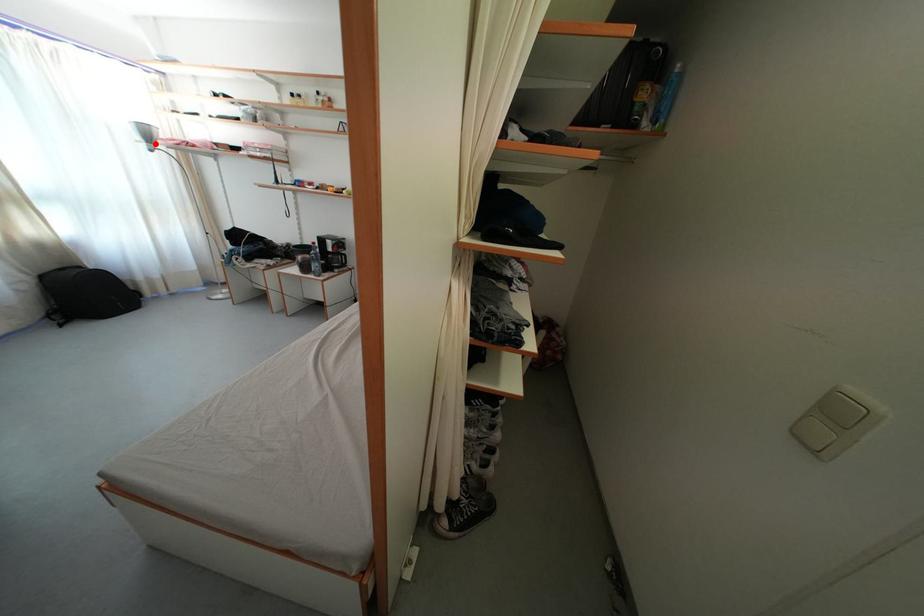
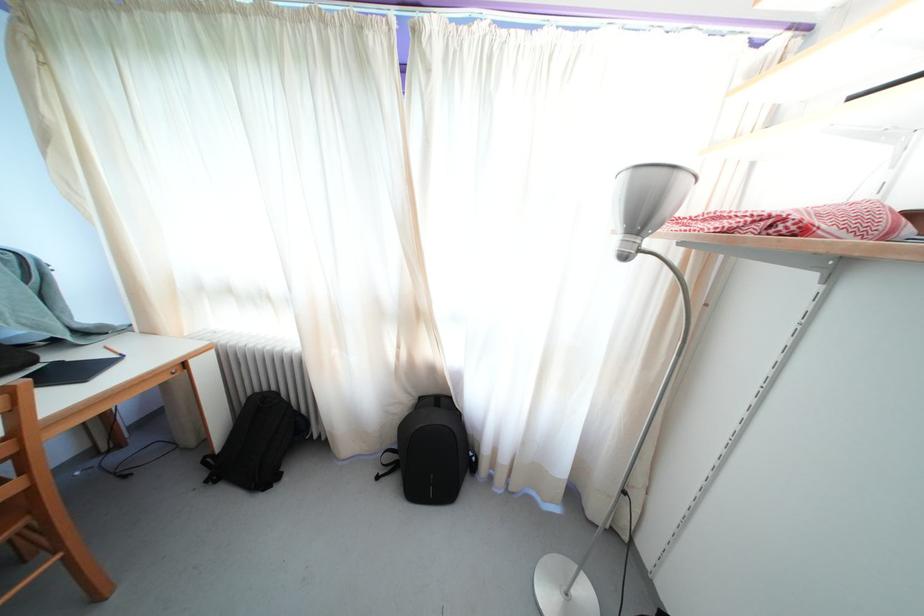
Where in the second image is the point corresponding to the highlighted location from the first image?

(648, 223)